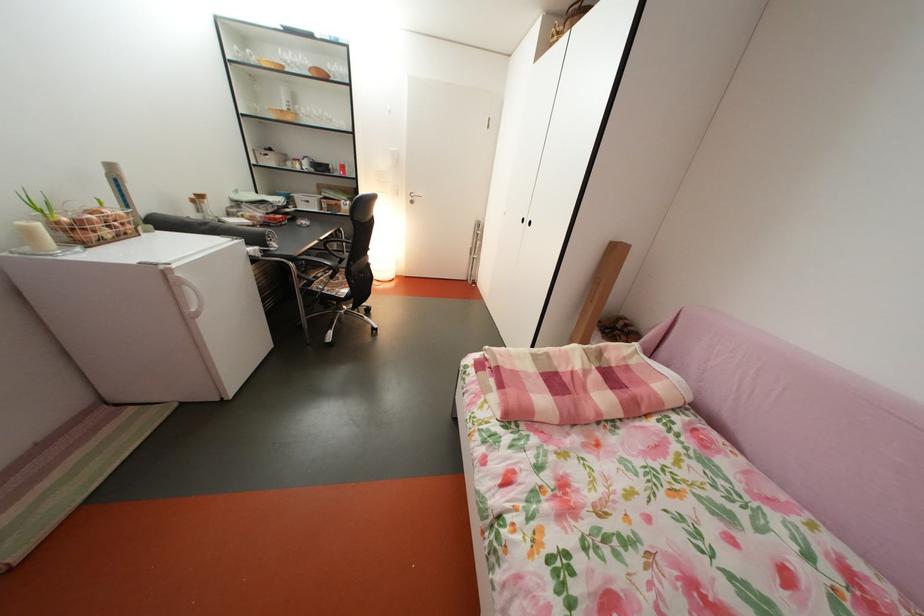
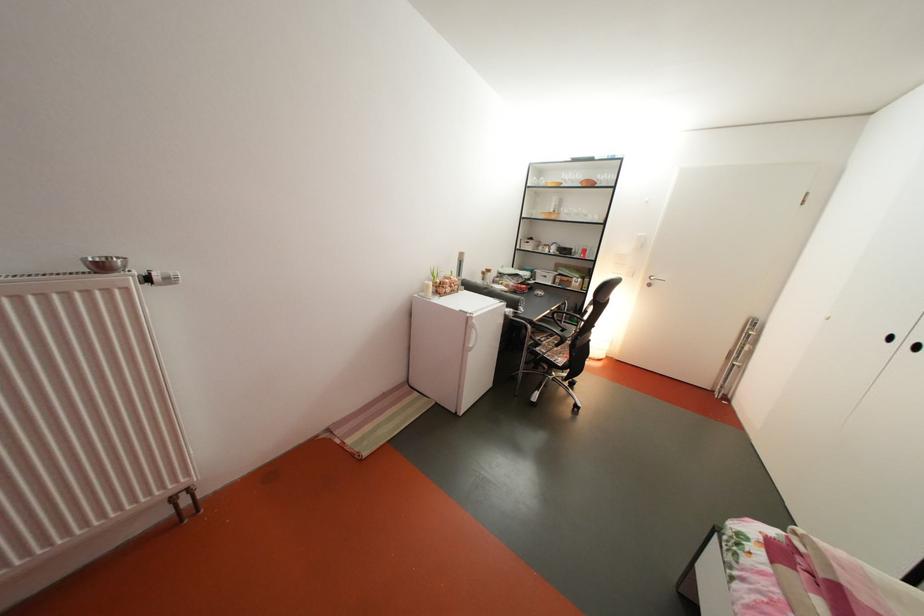
Find the pixel in the second image that matches the point at 297,115 in the first image.

(563, 217)